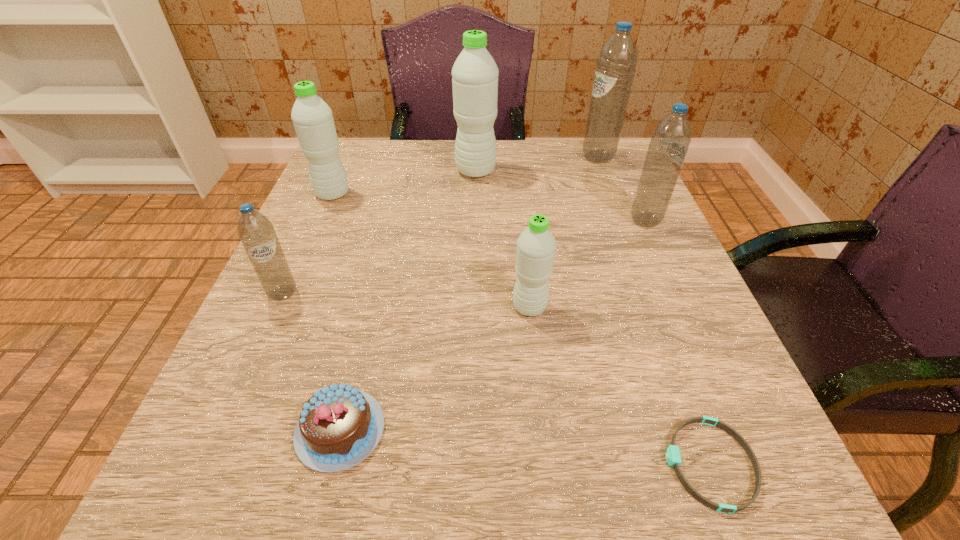
Identify the location of vacant space located on the back of the leftmost blue water bottle. The width and height of the screenshot is (960, 540). (339, 168).

Find the location of a particular element. The image size is (960, 540). vacant space located on the right of the third object from left to right is located at coordinates (484, 430).

This screenshot has height=540, width=960. Identify the location of free space located 0.350m on the buckle of the shortest object. (383, 464).

Locate an element on the screen. This screenshot has height=540, width=960. free spot located on the buckle of the shortest object is located at coordinates (456, 464).

The image size is (960, 540). Identify the location of blank space located 0.270m on the buckle of the shortest object. (447, 464).

Identify the location of chocolate cake present at the near edge. The image size is (960, 540). (339, 426).

Image resolution: width=960 pixels, height=540 pixels. Find the location of `wristband that is at the near edge`. wristband that is at the near edge is located at coordinates (673, 457).

This screenshot has height=540, width=960. I want to click on chocolate cake at the left edge, so click(x=339, y=426).

You are a GUI agent. You are given a task and a screenshot of the screen. Output one action in this format:
    pyautogui.click(x=<x>, y=<y>)
    Task: Click on the wristband positioned at the right edge
    The image size is (960, 540).
    Given the screenshot: What is the action you would take?
    pyautogui.click(x=673, y=457)

This screenshot has height=540, width=960. What are the coordinates of `object present at the far left corner` in the screenshot? It's located at (312, 118).